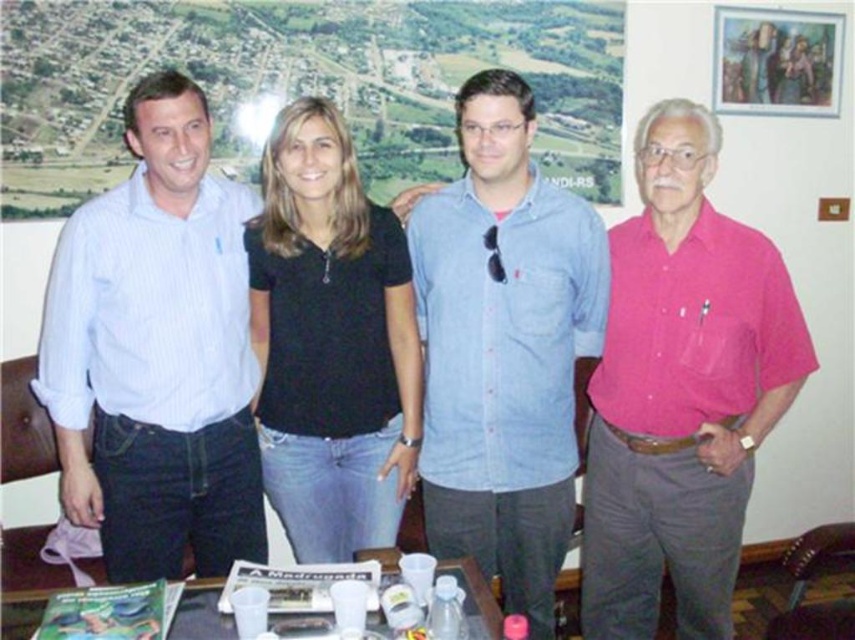
Question: Is denim shirt at center wider than wooden picture frame at upper right?

Choices:
 (A) yes
 (B) no

Answer: (A)

Question: Does denim shirt at center have a smaller size compared to wooden picture frame at upper right?

Choices:
 (A) yes
 (B) no

Answer: (B)

Question: Which object appears farthest from the camera in this image?

Choices:
 (A) denim shirt at center
 (B) pink cotton shirt at right
 (C) wooden picture frame at upper right

Answer: (C)

Question: Among these points, which one is farthest from the camera?

Choices:
 (A) (422, 276)
 (B) (721, 42)
 (C) (195, 561)

Answer: (B)

Question: Which is nearer to the black cotton shirt at center?

Choices:
 (A) pink cotton shirt at right
 (B) denim shirt at center
 (C) wooden picture frame at upper right

Answer: (B)

Question: Does pink cotton shirt at right have a greater width compared to translucent plastic cups at center?

Choices:
 (A) no
 (B) yes

Answer: (B)